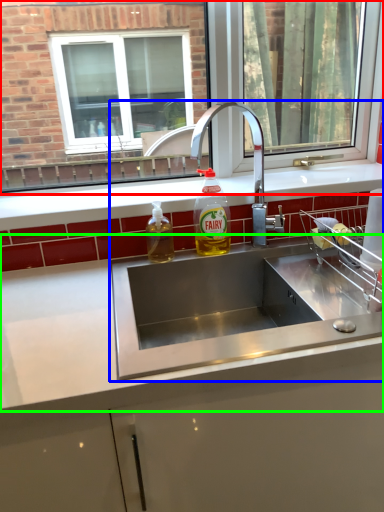
Question: Considering the real-world distances, which object is closest to window (highlighted by a red box)? sink (highlighted by a blue box) or countertop (highlighted by a green box).

Choices:
 (A) sink
 (B) countertop

Answer: (A)